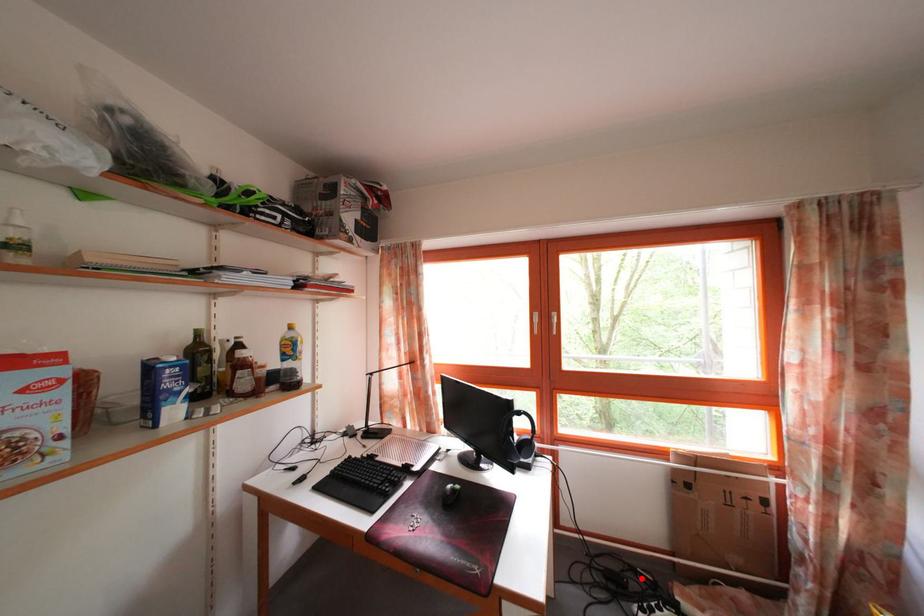
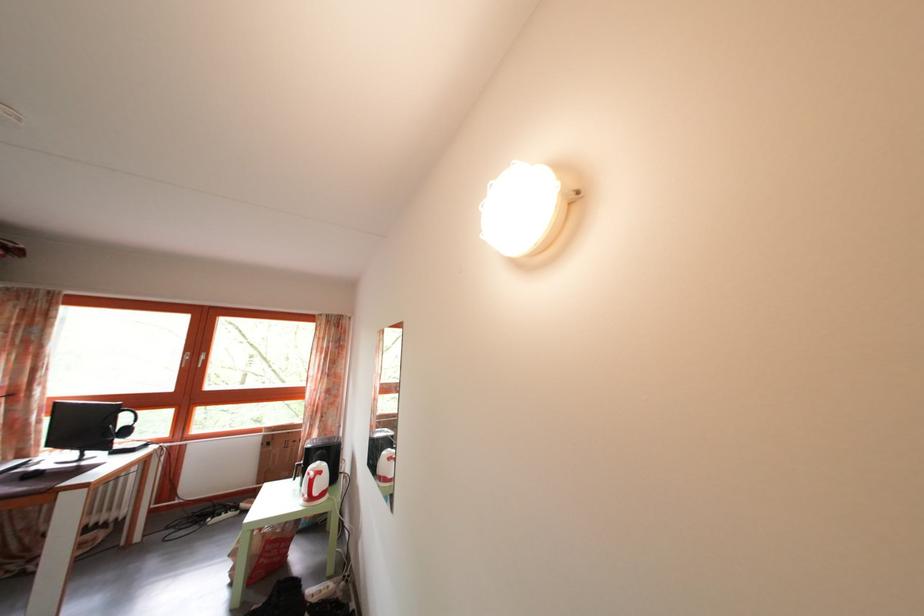
Where in the second image is the point corresponding to the highlighted location from the first image?

(233, 514)